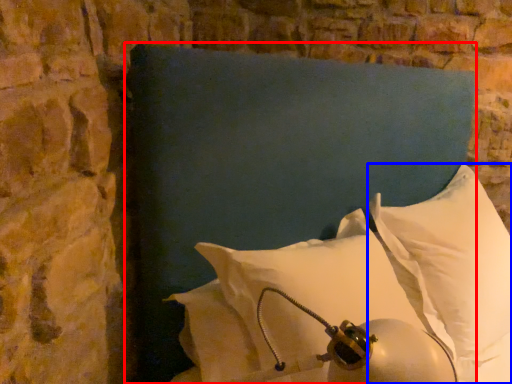
Question: Which object appears closest to the camera in this image, pillow (highlighted by a red box) or pillow (highlighted by a blue box)?

Choices:
 (A) pillow
 (B) pillow

Answer: (A)